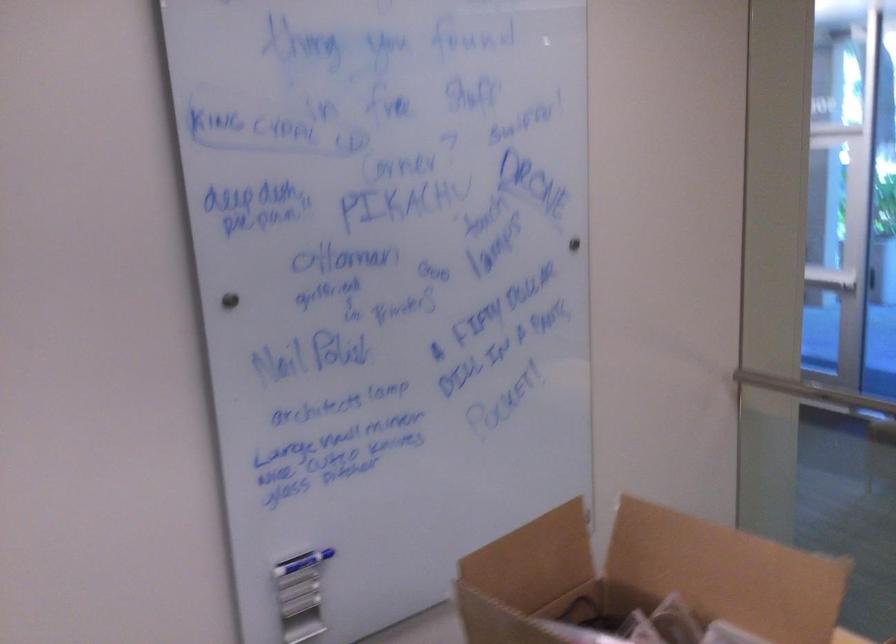
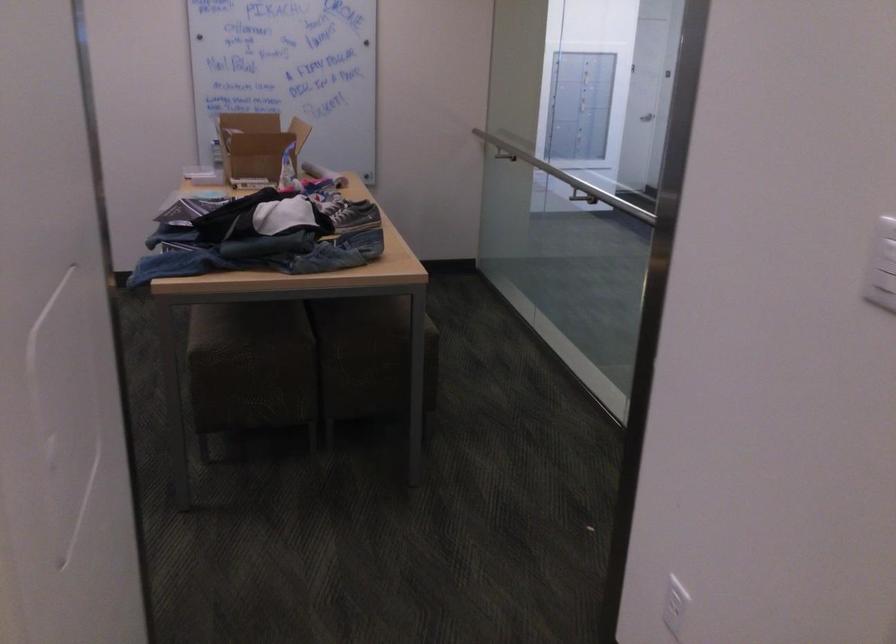
Question: I am providing you with two images of the same scene from different viewpoints. Which of the following objects are not visible in image2?

Choices:
 (A) cardboard box flap
 (B) diffuser bottle
 (C) white electrical outlet
 (D) metal handrail

Answer: (A)